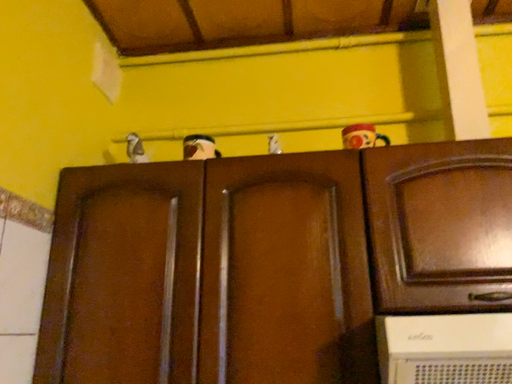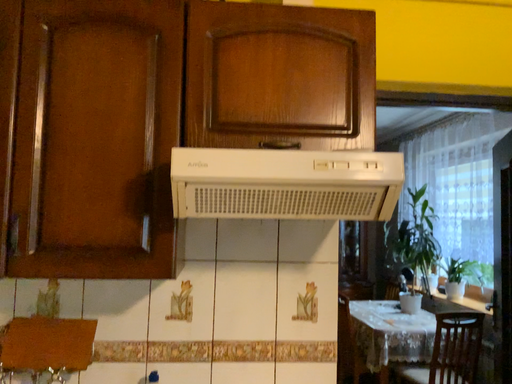
Question: Which way did the camera rotate in the video?

Choices:
 (A) rotated left
 (B) rotated right

Answer: (B)